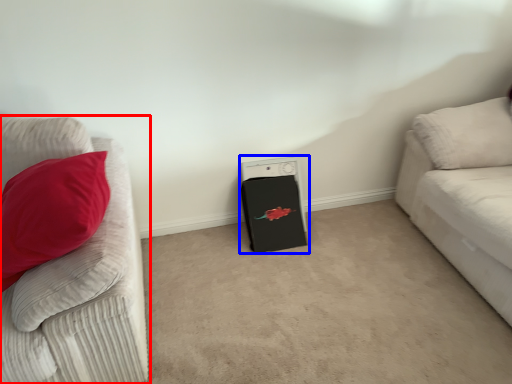
Question: Which object appears farthest to the camera in this image, studio couch (highlighted by a red box) or appliance (highlighted by a blue box)?

Choices:
 (A) studio couch
 (B) appliance

Answer: (B)